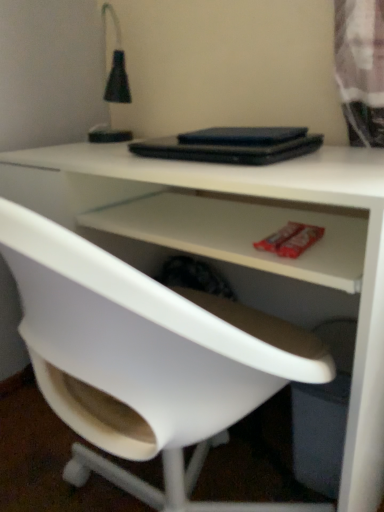
Question: Is black matte laptop at center completely or partially outside of white plastic chair at center?

Choices:
 (A) yes
 (B) no

Answer: (A)

Question: Does black matte laptop at center have a smaller size compared to white plastic chair at center?

Choices:
 (A) no
 (B) yes

Answer: (B)

Question: Is black matte laptop at center bigger than white plastic chair at center?

Choices:
 (A) yes
 (B) no

Answer: (B)

Question: Is black matte laptop at center to the left of white plastic chair at center from the viewer's perspective?

Choices:
 (A) yes
 (B) no

Answer: (B)

Question: From a real-world perspective, is black matte laptop at center on white plastic chair at center?

Choices:
 (A) no
 (B) yes

Answer: (B)

Question: Looking at their shapes, would you say black matte table lamp at upper left is wider or thinner than white plastic chair at center?

Choices:
 (A) thin
 (B) wide

Answer: (A)

Question: Considering the positions of black matte table lamp at upper left and white plastic chair at center in the image, is black matte table lamp at upper left bigger or smaller than white plastic chair at center?

Choices:
 (A) big
 (B) small

Answer: (B)

Question: Based on their positions, is black matte table lamp at upper left located to the left or right of white plastic chair at center?

Choices:
 (A) right
 (B) left

Answer: (B)

Question: Is black matte table lamp at upper left inside the boundaries of white plastic chair at center, or outside?

Choices:
 (A) inside
 (B) outside

Answer: (B)

Question: Is white plastic chair at center taller or shorter than black matte laptop at center?

Choices:
 (A) short
 (B) tall

Answer: (B)

Question: Is white plastic chair at center in front of or behind black matte laptop at center in the image?

Choices:
 (A) behind
 (B) front

Answer: (B)

Question: Considering the relative positions of white plastic chair at center and black matte laptop at center in the image provided, is white plastic chair at center to the left or to the right of black matte laptop at center?

Choices:
 (A) right
 (B) left

Answer: (B)

Question: From a real-world perspective, is white plastic chair at center physically located above or below black matte laptop at center?

Choices:
 (A) below
 (B) above

Answer: (A)

Question: Considering the positions of point (117, 92) and point (177, 151), is point (117, 92) closer or farther from the camera than point (177, 151)?

Choices:
 (A) closer
 (B) farther

Answer: (B)

Question: In terms of width, does black matte table lamp at upper left look wider or thinner when compared to black matte laptop at center?

Choices:
 (A) wide
 (B) thin

Answer: (B)